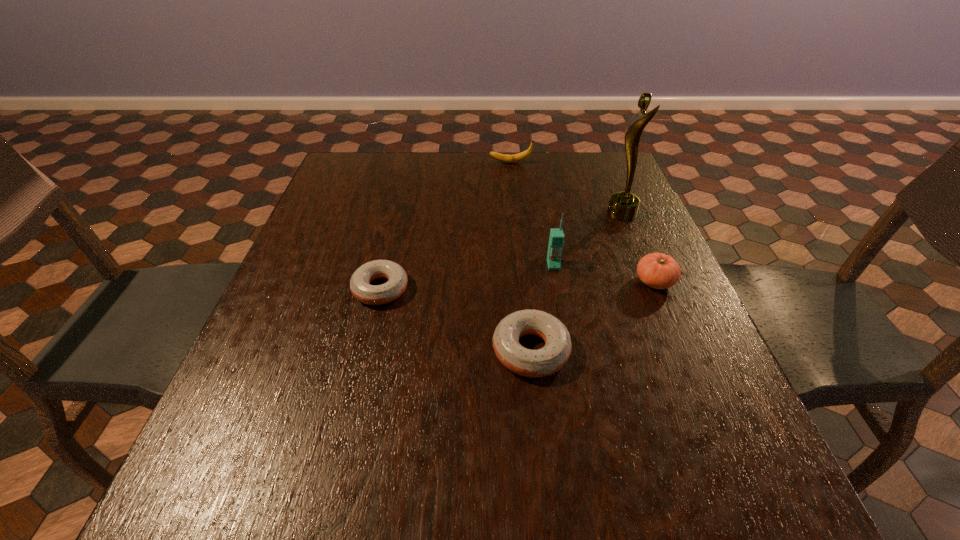
At what (x,y) coordinates should I click in order to perform the action: click on blank region between the leftmost object and the tallest object. Please return your answer as a coordinate pair (x, y). Looking at the image, I should click on (501, 251).

Locate an element on the screen. blank region between the shortest object and the tomato is located at coordinates (517, 285).

You are a GUI agent. You are given a task and a screenshot of the screen. Output one action in this format:
    pyautogui.click(x=<x>, y=<y>)
    Task: Click on the vacant area that lies between the tomato and the second tallest object
    The width and height of the screenshot is (960, 540).
    Given the screenshot: What is the action you would take?
    pyautogui.click(x=604, y=273)

In order to click on empty location between the second farthest object and the fifth tallest object in this screenshot , I will do `click(576, 282)`.

Locate an element on the screen. This screenshot has width=960, height=540. unoccupied position between the nearer doughnut and the shortest object is located at coordinates (456, 319).

You are a GUI agent. You are given a task and a screenshot of the screen. Output one action in this format:
    pyautogui.click(x=<x>, y=<y>)
    Task: Click on the free spot between the nearer doughnut and the farthest object
    
    Given the screenshot: What is the action you would take?
    pyautogui.click(x=520, y=256)

At what (x,y) coordinates should I click in order to perform the action: click on unoccupied area between the fifth tallest object and the tallest object. Please return your answer as a coordinate pair (x, y). The width and height of the screenshot is (960, 540). Looking at the image, I should click on (576, 282).

Identify which object is the nearest to the cellular telephone. Please provide its 2D coordinates. Your answer should be formatted as a tuple, i.e. [(x, y)], where the tuple contains the x and y coordinates of a point satisfying the conditions above.

[(549, 359)]

Locate which object ranks second in proximity to the nearest object. Please provide its 2D coordinates. Your answer should be formatted as a tuple, i.e. [(x, y)], where the tuple contains the x and y coordinates of a point satisfying the conditions above.

[(360, 287)]

What are the coordinates of `free space that satisfies the following two spatial constraints: 1. on the keypad of the tomato; 2. on the right side of the cellular telephone` in the screenshot? It's located at (556, 281).